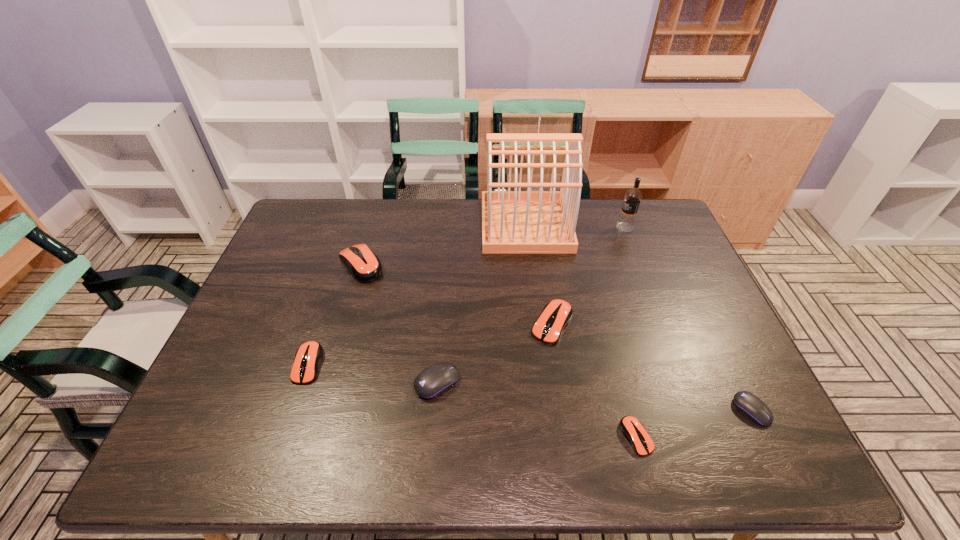
At what (x,y) coordinates should I click in order to perform the action: click on vodka at the right edge. Please return your answer as a coordinate pair (x, y). Looking at the image, I should click on (626, 222).

The height and width of the screenshot is (540, 960). Identify the location of computer mouse at the right edge. (748, 404).

Find the location of a particular element. object at the far right corner is located at coordinates (626, 222).

Where is `free space at the far edge`? The image size is (960, 540). free space at the far edge is located at coordinates (443, 240).

Image resolution: width=960 pixels, height=540 pixels. In order to click on free space at the near edge of the desktop in this screenshot , I will do `click(457, 453)`.

Identify the location of free space at the left edge of the desktop. This screenshot has width=960, height=540. (228, 397).

The height and width of the screenshot is (540, 960). I want to click on blank space at the right edge of the desktop, so point(718,336).

The width and height of the screenshot is (960, 540). What are the coordinates of `free space at the far left corner of the desktop` in the screenshot? It's located at (300, 218).

At what (x,y) coordinates should I click in order to perform the action: click on free region at the near left corner. Please return your answer as a coordinate pair (x, y). This screenshot has height=540, width=960. Looking at the image, I should click on (233, 468).

Find the location of a particular element. The image size is (960, 540). vacant space at the near right corner of the desktop is located at coordinates (709, 444).